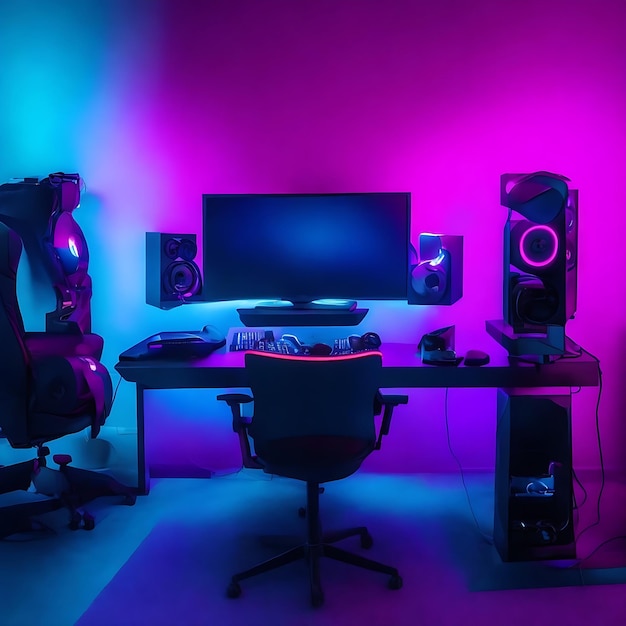
This screenshot has width=626, height=626. Find the location of `computer desk`. computer desk is located at coordinates (408, 381).